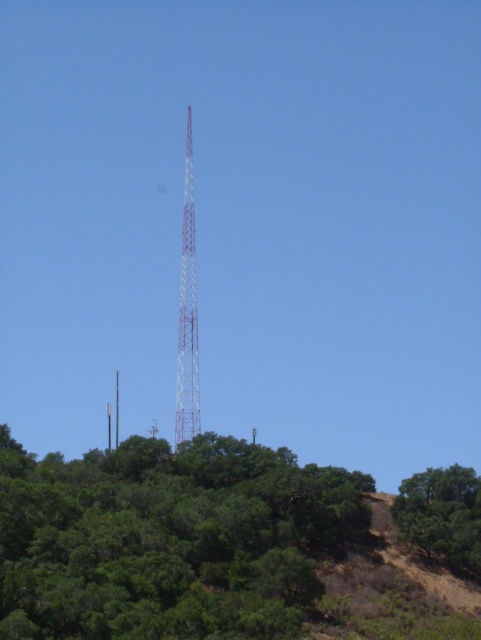
Question: Which of these objects is positioned farthest from the metallic tower at center?

Choices:
 (A) metallic white tower at center
 (B) green leafy tree at center

Answer: (B)

Question: Does green leafy tree at lower right appear on the left side of red painted metal tower at center?

Choices:
 (A) yes
 (B) no

Answer: (B)

Question: Which object appears farthest from the camera in this image?

Choices:
 (A) green leafy tree at center
 (B) metallic white tower at center
 (C) green leafy tree at lower right
 (D) red painted metal tower at center

Answer: (B)

Question: Does green leafy tree at lower right have a larger size compared to metallic tower at center?

Choices:
 (A) yes
 (B) no

Answer: (B)

Question: Which point appears farthest from the camera in this image?

Choices:
 (A) (188, 166)
 (B) (458, 525)
 (C) (115, 378)

Answer: (C)

Question: Does green leafy tree at center lie behind metallic white tower at center?

Choices:
 (A) no
 (B) yes

Answer: (A)